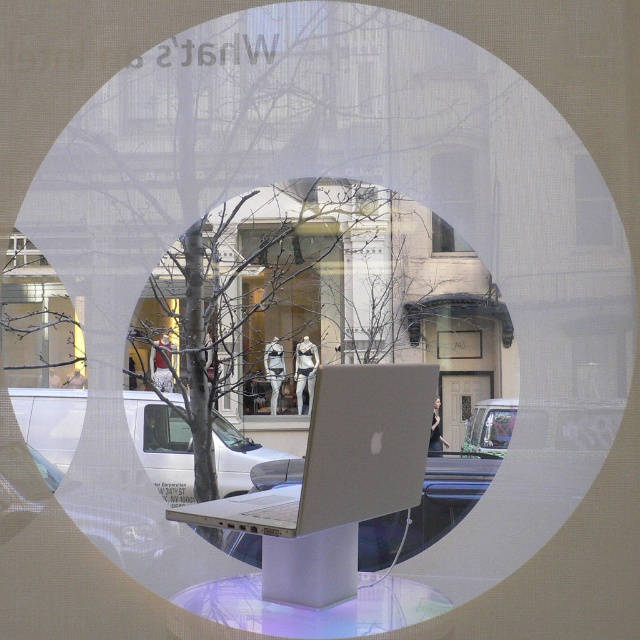
Question: Which object appears closest to the camera in this image?

Choices:
 (A) clear glass window at upper center
 (B) white matte van at center
 (C) metallic silver car at center
 (D) silver metallic laptop at center

Answer: (D)

Question: Can you confirm if clear glass mannequins at center is smaller than white matte van at center?

Choices:
 (A) yes
 (B) no

Answer: (A)

Question: Does silver metallic laptop at center appear on the left side of clear glass mannequins at center?

Choices:
 (A) no
 (B) yes

Answer: (A)

Question: Which point is closer to the camera?

Choices:
 (A) clear glass window at upper left
 (B) white matte van at center
 (C) clear glass window at upper center
 (D) clear glass mannequins at center

Answer: (A)

Question: Does silver metallic laptop at center appear on the left side of metallic silver car at center?

Choices:
 (A) yes
 (B) no

Answer: (A)

Question: Which point is closer to the camera?

Choices:
 (A) clear glass mannequins at center
 (B) clear glass window at upper left
 (C) white matte van at center
 (D) silver metallic laptop at center

Answer: (D)